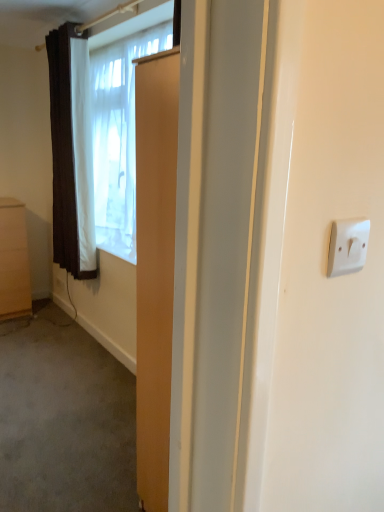
Question: From their relative heights in the image, would you say white sheer curtain at upper left is taller or shorter than brown textured curtain at left?

Choices:
 (A) short
 (B) tall

Answer: (A)

Question: Would you say white sheer curtain at upper left is to the left or to the right of brown textured curtain at left in the picture?

Choices:
 (A) right
 (B) left

Answer: (A)

Question: Estimate the real-world distances between objects in this image. Which object is farther from the matte brown cabinet at left?

Choices:
 (A) brown textured curtain at left
 (B) white sheer curtain at upper left

Answer: (B)

Question: Which is farther from the white sheer curtain at upper left?

Choices:
 (A) matte brown cabinet at left
 (B) brown textured curtain at left

Answer: (A)